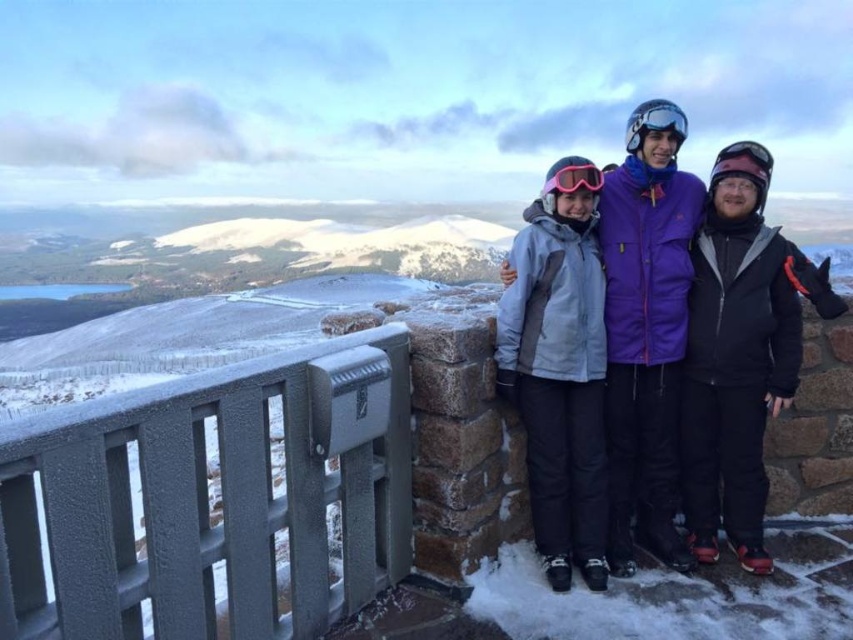
Question: Does gray plastic rail at left have a lesser width compared to pink matte goggles at center?

Choices:
 (A) no
 (B) yes

Answer: (A)

Question: Is matte purple jacket at center smaller than pink matte goggles at center?

Choices:
 (A) yes
 (B) no

Answer: (A)

Question: Which point is closer to the camera?

Choices:
 (A) pink matte goggles at center
 (B) matte purple jacket at center

Answer: (A)

Question: Among these objects, which one is farthest from the camera?

Choices:
 (A) pink matte goggles at center
 (B) matte purple jacket at center
 (C) gray plastic rail at left

Answer: (B)

Question: Is the position of matte purple jacket at center less distant than that of pink matte goggles at center?

Choices:
 (A) yes
 (B) no

Answer: (B)

Question: Which object is positioned closest to the matte purple jacket at center?

Choices:
 (A) gray plastic rail at left
 (B) pink matte goggles at center

Answer: (B)